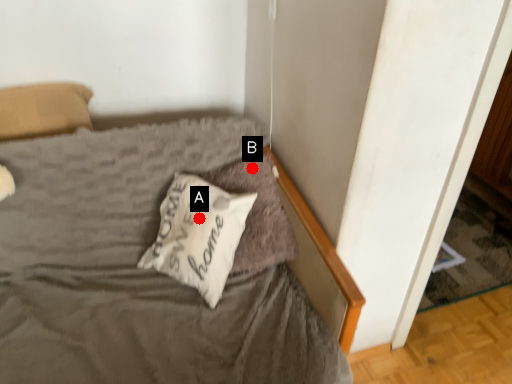
Question: Two points are circled on the image, labeled by A and B beside each circle. Which point is further to the camera?

Choices:
 (A) A is further
 (B) B is further

Answer: (B)